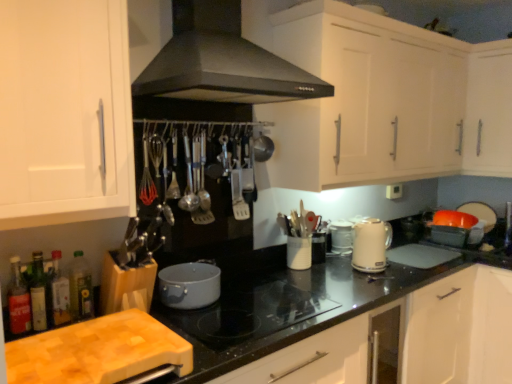
Question: From the image's perspective, is translucent glass bottle at lower left, which is the third bottle from right to left, over green matte bottle at lower left, arranged as the first bottle when viewed from the right?

Choices:
 (A) no
 (B) yes

Answer: (A)

Question: Is translucent glass bottle at lower left, which is the third bottle from right to left, not within green matte bottle at lower left, arranged as the first bottle when viewed from the right?

Choices:
 (A) yes
 (B) no

Answer: (A)

Question: Considering the relative sizes of translucent glass bottle at lower left, the second bottle in the left-to-right sequence, and green matte bottle at lower left, arranged as the first bottle when viewed from the right, in the image provided, is translucent glass bottle at lower left, the second bottle in the left-to-right sequence, thinner than green matte bottle at lower left, arranged as the first bottle when viewed from the right,?

Choices:
 (A) no
 (B) yes

Answer: (A)

Question: From a real-world perspective, is translucent glass bottle at lower left, which is the third bottle from right to left, on green matte bottle at lower left, which is the fourth bottle in left-to-right order?

Choices:
 (A) yes
 (B) no

Answer: (A)

Question: Does translucent glass bottle at lower left, the second bottle in the left-to-right sequence, lie in front of green matte bottle at lower left, arranged as the first bottle when viewed from the right?

Choices:
 (A) yes
 (B) no

Answer: (A)

Question: Is beige glossy electric kettle at right in front of or behind red rubber whisk at upper left in the image?

Choices:
 (A) front
 (B) behind

Answer: (B)

Question: Visually, is beige glossy electric kettle at right positioned to the left or to the right of red rubber whisk at upper left?

Choices:
 (A) left
 (B) right

Answer: (B)

Question: Considering the positions of beige glossy electric kettle at right and red rubber whisk at upper left in the image, is beige glossy electric kettle at right wider or thinner than red rubber whisk at upper left?

Choices:
 (A) wide
 (B) thin

Answer: (A)

Question: In terms of size, does beige glossy electric kettle at right appear bigger or smaller than red rubber whisk at upper left?

Choices:
 (A) small
 (B) big

Answer: (B)

Question: Which is correct: red rubber whisk at upper left is inside beige glossy electric kettle at right, or outside of it?

Choices:
 (A) inside
 (B) outside

Answer: (B)

Question: From the image's perspective, relative to beige glossy electric kettle at right, is red rubber whisk at upper left above or below?

Choices:
 (A) above
 (B) below

Answer: (A)

Question: Is point (153, 182) closer or farther from the camera than point (365, 253)?

Choices:
 (A) closer
 (B) farther

Answer: (A)

Question: In the image, is red rubber whisk at upper left positioned in front of or behind beige glossy electric kettle at right?

Choices:
 (A) behind
 (B) front

Answer: (B)

Question: Considering the positions of point (32, 292) and point (368, 256), is point (32, 292) closer or farther from the camera than point (368, 256)?

Choices:
 (A) farther
 (B) closer

Answer: (B)

Question: From the image's perspective, is translucent glass bottle at lower left, the second bottle in the left-to-right sequence, above or below beige glossy electric kettle at right?

Choices:
 (A) above
 (B) below

Answer: (B)